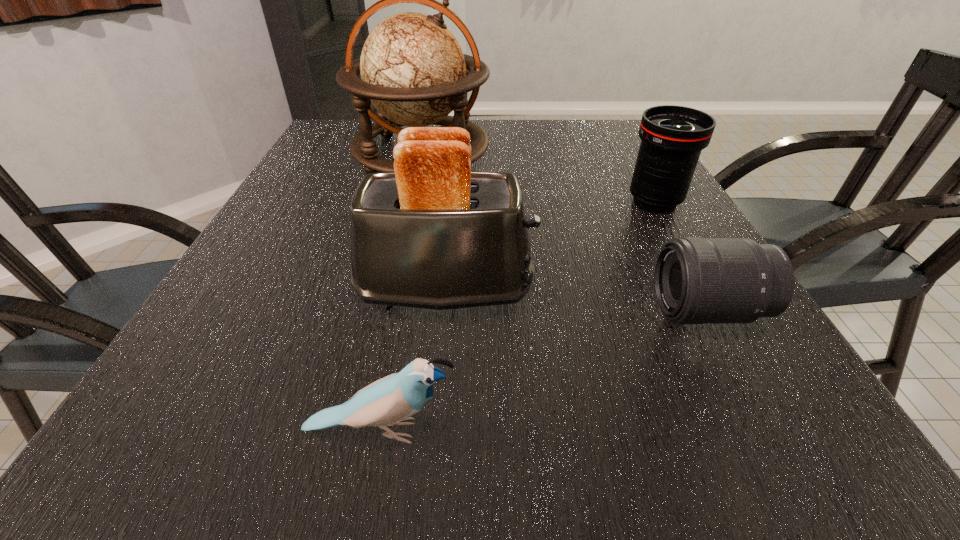
At what (x,y) coordinates should I click in order to perform the action: click on globe. Please return your answer as a coordinate pair (x, y). Image resolution: width=960 pixels, height=540 pixels. Looking at the image, I should click on (413, 71).

Find the location of a particular element. This screenshot has height=540, width=960. the farthest object is located at coordinates (413, 71).

Identify the location of the second tallest object. (433, 234).

Identify the location of the fourth nearest object. Image resolution: width=960 pixels, height=540 pixels. (672, 137).

Where is `the farther telephoto lens`? the farther telephoto lens is located at coordinates (672, 137).

I want to click on bird, so click(x=390, y=401).

Where is `the shorter telephoto lens`? the shorter telephoto lens is located at coordinates (697, 280).

Where is `vacant position located 0.110m on the front of the globe`? Image resolution: width=960 pixels, height=540 pixels. vacant position located 0.110m on the front of the globe is located at coordinates (408, 211).

Find the location of a particular element. The image size is (960, 540). vacant area situated 0.100m on the side of the second tallest object with the control lever is located at coordinates (590, 290).

Identify the location of vacant space located 0.130m on the left of the fourth nearest object. (566, 202).